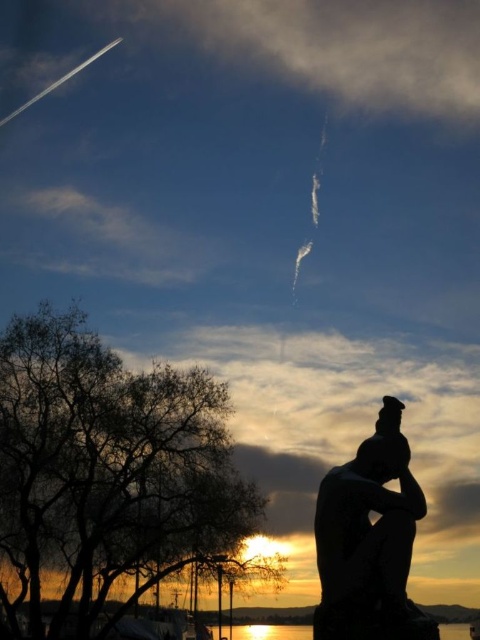
Does point (346, 596) come closer to viewer compared to point (276, 634)?

Yes.

This screenshot has width=480, height=640. In order to click on silhouette statue at lower right in this screenshot , I will do `click(370, 540)`.